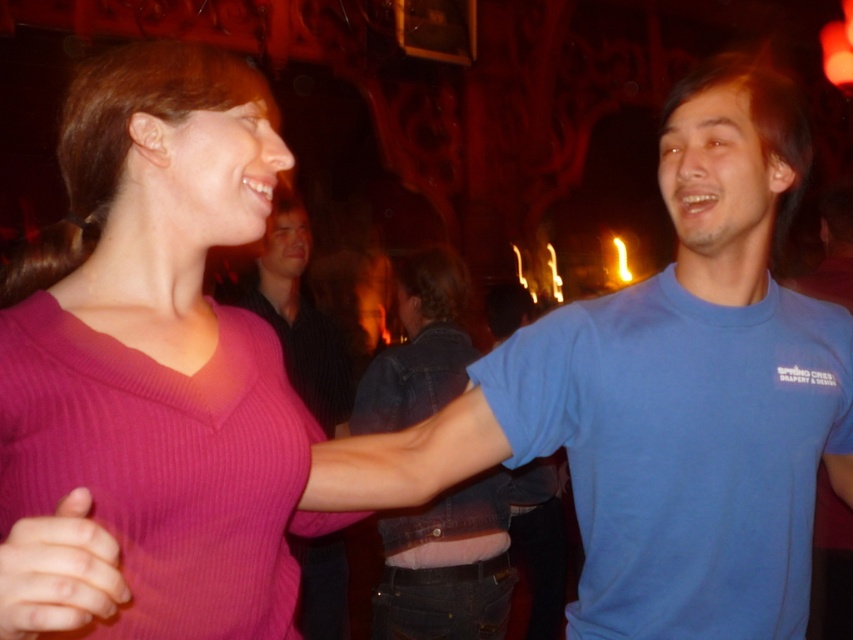
Question: Estimate the real-world distances between objects in this image. Which object is closer to the blue cotton t-shirt at center?

Choices:
 (A) pink ribbed sweater at lower left
 (B) pink ribbed sweater at center

Answer: (B)

Question: Which object is the closest to the pink ribbed sweater at center?

Choices:
 (A) blue cotton t-shirt at center
 (B) pink ribbed sweater at lower left

Answer: (B)

Question: Is pink ribbed sweater at center to the right of pink ribbed sweater at lower left from the viewer's perspective?

Choices:
 (A) yes
 (B) no

Answer: (B)

Question: Based on their relative distances, which object is nearer to the blue cotton t-shirt at center?

Choices:
 (A) pink ribbed sweater at lower left
 (B) pink ribbed sweater at center

Answer: (B)

Question: Is the position of pink ribbed sweater at center less distant than that of blue cotton t-shirt at center?

Choices:
 (A) no
 (B) yes

Answer: (B)

Question: Observing the image, what is the correct spatial positioning of pink ribbed sweater at center in reference to blue cotton t-shirt at center?

Choices:
 (A) left
 (B) right

Answer: (B)